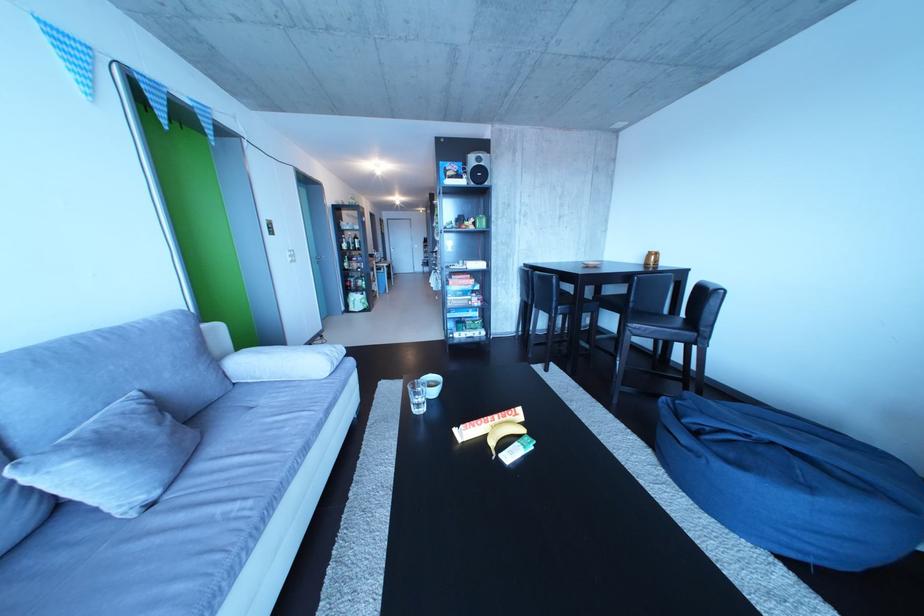
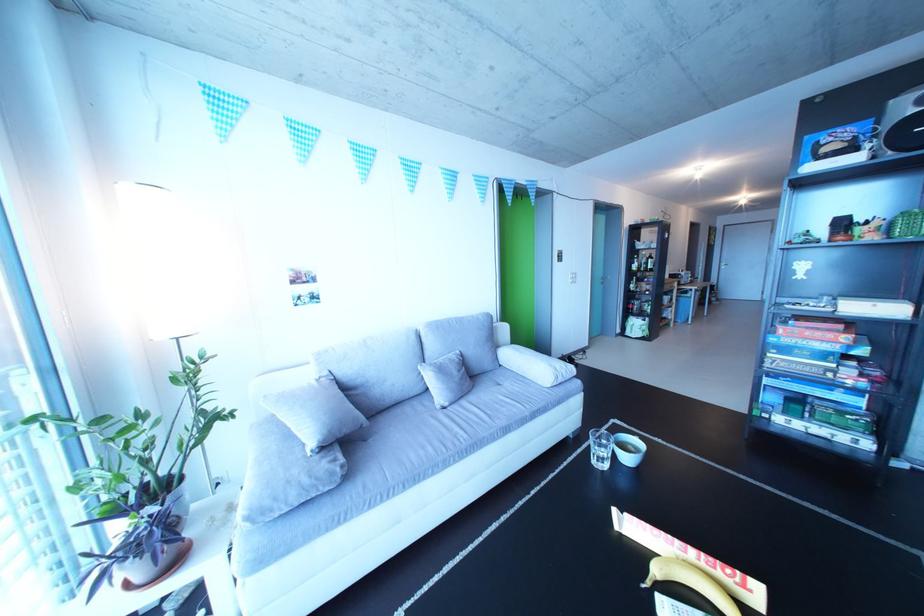
Where in the second image is the point corresponding to point 373,410 from the first image?

(594, 435)